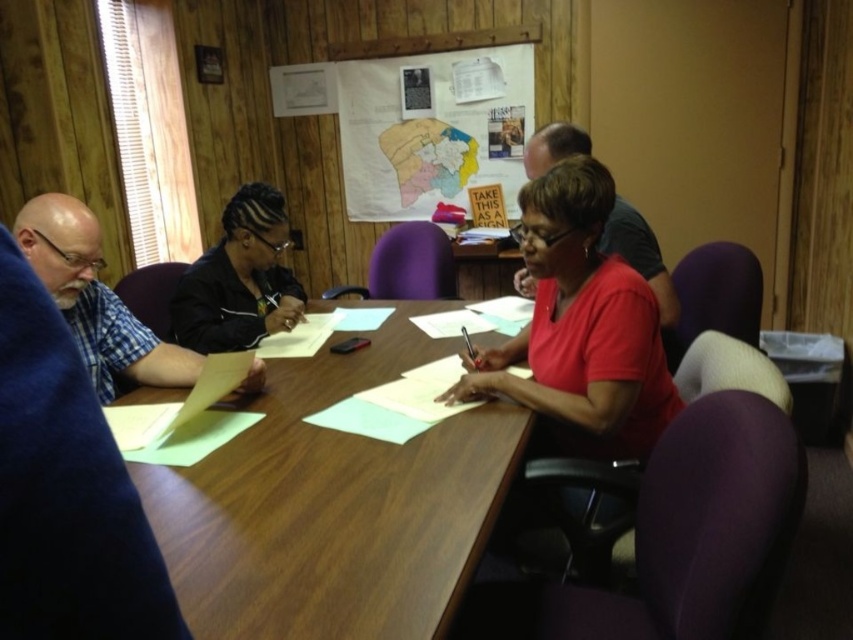
Where is `wooden table at center`? The width and height of the screenshot is (853, 640). wooden table at center is located at coordinates (334, 506).

Is wooden table at center smaller than matte black shirt at upper center?

Actually, wooden table at center might be larger than matte black shirt at upper center.

Is point (402, 340) farther from viewer compared to point (645, 275)?

Yes.

I want to click on wooden table at center, so click(334, 506).

Is point (410, 77) in front of point (140, 384)?

No, (410, 77) is further to viewer.

Can you confirm if paper map at upper center is positioned to the right of blue plaid shirt at left?

Indeed, paper map at upper center is positioned on the right side of blue plaid shirt at left.

Describe the element at coordinates (432, 120) in the screenshot. This screenshot has height=640, width=853. I see `paper map at upper center` at that location.

Locate an element on the screen. This screenshot has width=853, height=640. paper map at upper center is located at coordinates (432, 120).

Who is shorter, wooden table at center or blue plaid shirt at left?

wooden table at center

Who is positioned more to the right, wooden table at center or blue plaid shirt at left?

wooden table at center is more to the right.

Find the location of a particular element. This screenshot has width=853, height=640. wooden table at center is located at coordinates (334, 506).